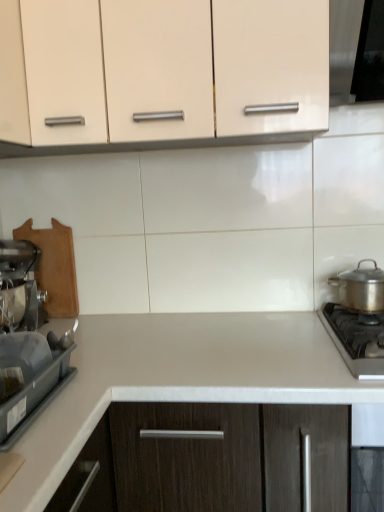
Question: Is satin silver pot at right, the 1th kitchen appliance positioned from the right, to the right of stainless steel gas stove at lower right from the viewer's perspective?

Choices:
 (A) no
 (B) yes

Answer: (B)

Question: From a real-world perspective, is satin silver pot at right, the 1th kitchen appliance positioned from the right, located beneath stainless steel gas stove at lower right?

Choices:
 (A) no
 (B) yes

Answer: (A)

Question: Is satin silver pot at right, the 1th kitchen appliance positioned from the right, completely or partially outside of stainless steel gas stove at lower right?

Choices:
 (A) no
 (B) yes

Answer: (B)

Question: Is the depth of satin silver pot at right, the 2th kitchen appliance when ordered from left to right, less than that of stainless steel gas stove at lower right?

Choices:
 (A) yes
 (B) no

Answer: (B)

Question: Is satin silver pot at right, the 2th kitchen appliance when ordered from left to right, turned away from stainless steel gas stove at lower right?

Choices:
 (A) yes
 (B) no

Answer: (B)

Question: Considering the positions of matte cream cabinet at upper center and stainless steel gas stove at lower right in the image, is matte cream cabinet at upper center bigger or smaller than stainless steel gas stove at lower right?

Choices:
 (A) small
 (B) big

Answer: (B)

Question: Is matte cream cabinet at upper center taller or shorter than stainless steel gas stove at lower right?

Choices:
 (A) short
 (B) tall

Answer: (B)

Question: Is point coord(99,54) positioned closer to the camera than point coord(326,320)?

Choices:
 (A) farther
 (B) closer

Answer: (B)

Question: Is matte cream cabinet at upper center inside the boundaries of stainless steel gas stove at lower right, or outside?

Choices:
 (A) outside
 (B) inside

Answer: (A)

Question: From the image's perspective, is metallic silver mixer at left, arranged as the second kitchen appliance when viewed from the right, positioned above or below white laminate countertop at center?

Choices:
 (A) above
 (B) below

Answer: (A)

Question: Do you think metallic silver mixer at left, the first kitchen appliance when ordered from left to right, is within white laminate countertop at center, or outside of it?

Choices:
 (A) inside
 (B) outside

Answer: (B)

Question: Considering the relative positions of metallic silver mixer at left, the first kitchen appliance when ordered from left to right, and white laminate countertop at center in the image provided, is metallic silver mixer at left, the first kitchen appliance when ordered from left to right, to the left or to the right of white laminate countertop at center?

Choices:
 (A) left
 (B) right

Answer: (A)

Question: Is point (28, 260) closer or farther from the camera than point (122, 394)?

Choices:
 (A) closer
 (B) farther

Answer: (B)

Question: From a real-world perspective, relative to matte cream cabinet at upper center, is white laminate countertop at center vertically above or below?

Choices:
 (A) below
 (B) above

Answer: (A)

Question: From the image's perspective, is white laminate countertop at center located above or below matte cream cabinet at upper center?

Choices:
 (A) below
 (B) above

Answer: (A)